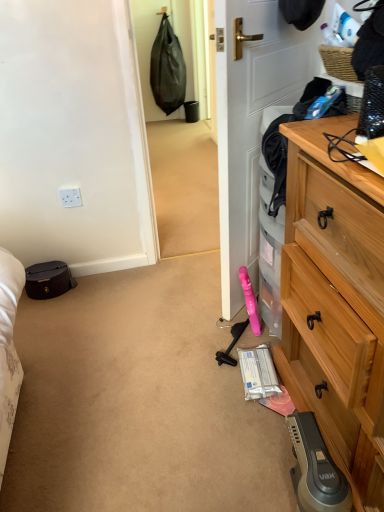
Question: Can you confirm if white matte door at center is wider than woven brown picnic basket at upper right?

Choices:
 (A) no
 (B) yes

Answer: (A)

Question: Is white matte door at center shorter than woven brown picnic basket at upper right?

Choices:
 (A) no
 (B) yes

Answer: (A)

Question: Could you tell me if white matte door at center is facing woven brown picnic basket at upper right?

Choices:
 (A) no
 (B) yes

Answer: (A)

Question: Considering the relative sizes of white matte door at center and woven brown picnic basket at upper right in the image provided, is white matte door at center smaller than woven brown picnic basket at upper right?

Choices:
 (A) yes
 (B) no

Answer: (B)

Question: From a real-world perspective, does white matte door at center sit lower than woven brown picnic basket at upper right?

Choices:
 (A) yes
 (B) no

Answer: (A)

Question: From a real-world perspective, relative to white plastic power outlet at upper left, is matte black suitcase at left vertically above or below?

Choices:
 (A) above
 (B) below

Answer: (B)

Question: In the image, is matte black suitcase at left on the left side or the right side of white plastic power outlet at upper left?

Choices:
 (A) right
 (B) left

Answer: (B)

Question: Would you say matte black suitcase at left is inside or outside white plastic power outlet at upper left?

Choices:
 (A) outside
 (B) inside

Answer: (A)

Question: Considering the positions of matte black suitcase at left and white plastic power outlet at upper left in the image, is matte black suitcase at left bigger or smaller than white plastic power outlet at upper left?

Choices:
 (A) small
 (B) big

Answer: (B)

Question: Would you say woven brown picnic basket at upper right is inside or outside white matte door at center?

Choices:
 (A) outside
 (B) inside

Answer: (A)

Question: Does point (347, 64) appear closer or farther from the camera than point (246, 232)?

Choices:
 (A) closer
 (B) farther

Answer: (A)

Question: From a real-world perspective, is woven brown picnic basket at upper right physically located above or below white matte door at center?

Choices:
 (A) below
 (B) above

Answer: (B)

Question: In terms of width, does woven brown picnic basket at upper right look wider or thinner when compared to white matte door at center?

Choices:
 (A) wide
 (B) thin

Answer: (A)

Question: From the image's perspective, is matte black suitcase at left positioned above or below wooden chest of drawers at right?

Choices:
 (A) below
 (B) above

Answer: (B)

Question: Considering their positions, is matte black suitcase at left located in front of or behind wooden chest of drawers at right?

Choices:
 (A) behind
 (B) front

Answer: (A)